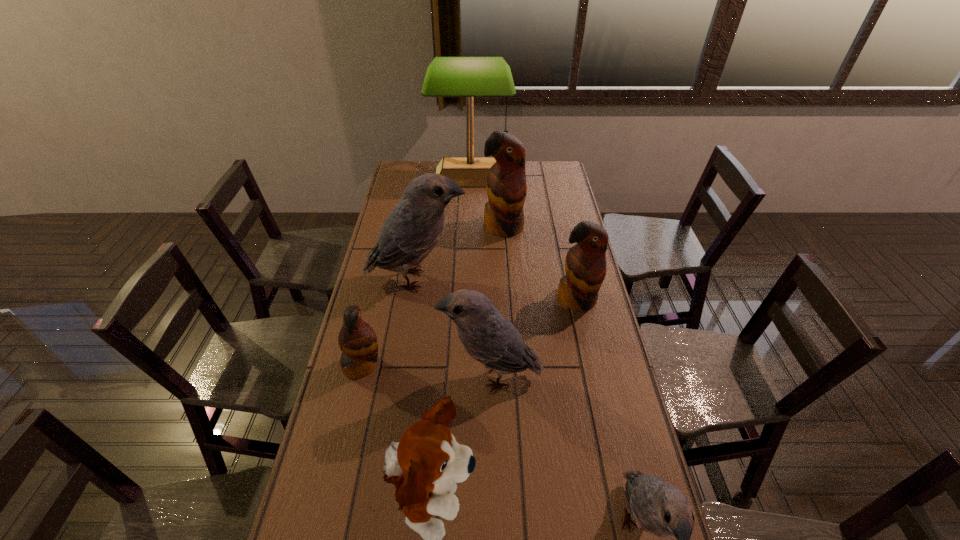
Where is `green table lamp`? The width and height of the screenshot is (960, 540). green table lamp is located at coordinates (469, 77).

Identify the location of table lamp. (469, 77).

You are a GUI agent. You are given a task and a screenshot of the screen. Output one action in this format:
    pyautogui.click(x=<x>, y=<y>)
    Task: Click on the farthest gray parrot
    
    Given the screenshot: What is the action you would take?
    pyautogui.click(x=411, y=231)

In order to click on the biggest red parrot in this screenshot , I will do `click(506, 183)`.

Where is `the second red parrot from right to left`? The width and height of the screenshot is (960, 540). the second red parrot from right to left is located at coordinates (506, 183).

Image resolution: width=960 pixels, height=540 pixels. I want to click on the second nearest red parrot, so click(x=585, y=264).

At what (x,y) coordinates should I click in order to perform the action: click on the rightmost red parrot. Please return your answer as a coordinate pair (x, y). This screenshot has height=540, width=960. Looking at the image, I should click on (585, 264).

The height and width of the screenshot is (540, 960). I want to click on the second nearest gray parrot, so click(x=486, y=335).

I want to click on the nearest red parrot, so click(358, 342).

In order to click on the leftmost red parrot in this screenshot , I will do `click(358, 342)`.